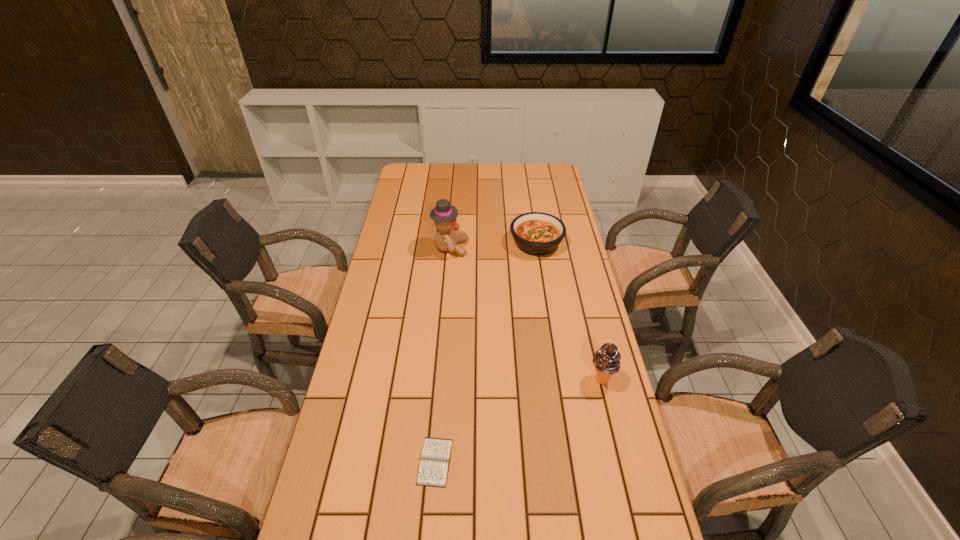
Identify the location of vacant space in between the second shortest object and the nearest object. This screenshot has height=540, width=960. (486, 353).

Identify the location of free space between the diary and the tallest object. This screenshot has height=540, width=960. (443, 355).

Find the location of a particular element. The height and width of the screenshot is (540, 960). empty location between the nearest object and the icecream is located at coordinates (518, 421).

This screenshot has width=960, height=540. In order to click on unoccupied area between the second nearest object and the rag_doll in this screenshot , I will do `click(526, 314)`.

Image resolution: width=960 pixels, height=540 pixels. I want to click on empty space that is in between the diary and the stew, so click(x=486, y=353).

Find the location of a particular element. Image resolution: width=960 pixels, height=540 pixels. vacant area between the tallest object and the third shortest object is located at coordinates (526, 314).

Locate an element on the screen. Image resolution: width=960 pixels, height=540 pixels. object that is the third closest to the stew is located at coordinates (433, 470).

I want to click on object that can be found as the third closest to the third shortest object, so point(444,214).

This screenshot has width=960, height=540. I want to click on vacant area that satisfies the following two spatial constraints: 1. on the front-facing side of the second nearest object; 2. on the right side of the rag_doll, so click(x=440, y=380).

This screenshot has height=540, width=960. In order to click on free space that satisfies the following two spatial constraints: 1. on the front-facing side of the tallest object; 2. on the back side of the third shortest object in this screenshot , I will do [440, 380].